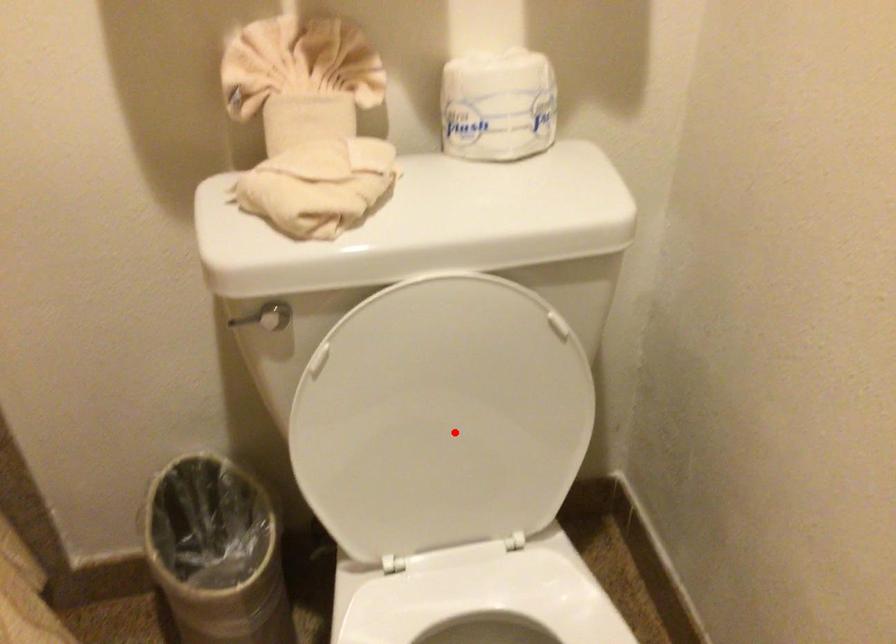
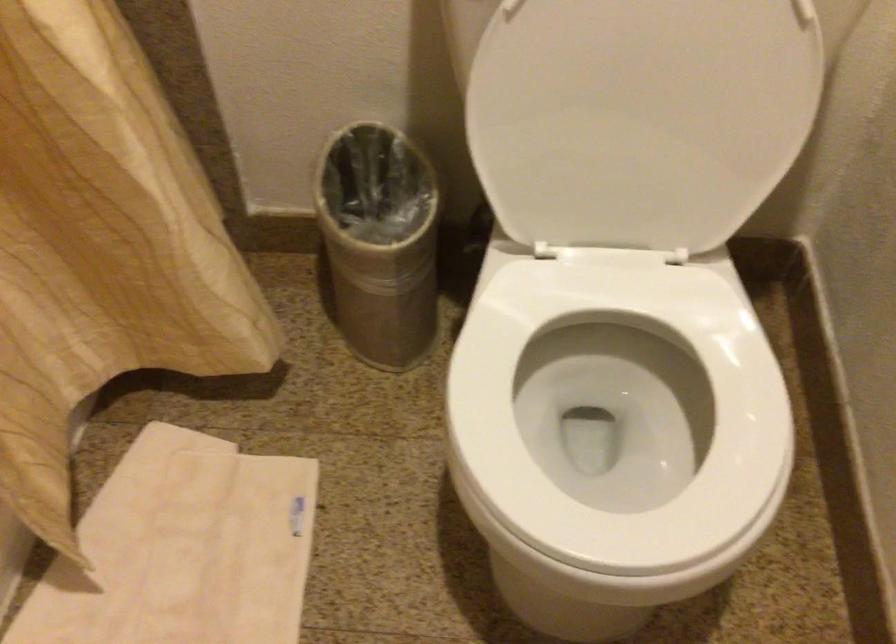
The point at the highlighted location is marked in the first image. Where is the corresponding point in the second image?

(640, 118)